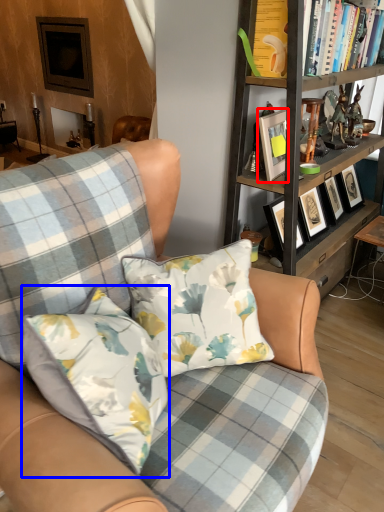
Question: Which object is closer to the camera taking this photo, picture frame (highlighted by a red box) or pillow (highlighted by a blue box)?

Choices:
 (A) picture frame
 (B) pillow

Answer: (B)